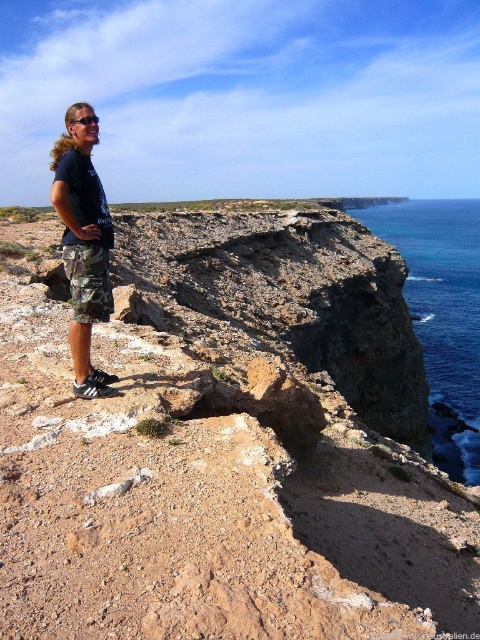
Which is in front, point (474, 452) or point (91, 320)?

Point (91, 320) is in front.

Which is more to the left, blue liquid water at upper right or camo shorts at center?

camo shorts at center is more to the left.

The height and width of the screenshot is (640, 480). I want to click on blue liquid water at upper right, so click(x=442, y=314).